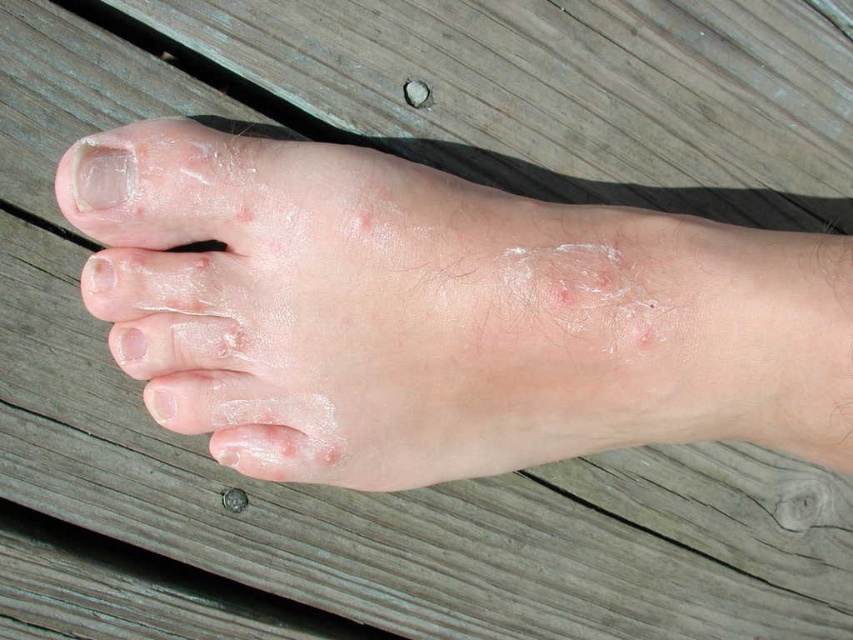
Between dry skin at center and white matte nail at upper left, which one has more height?

With more height is dry skin at center.

Does point (575, 244) come behind point (126, 193)?

That is True.

Does point (389, 294) lie behind point (109, 138)?

That is False.

The height and width of the screenshot is (640, 853). What are the coordinates of `dry skin at center` in the screenshot? It's located at (450, 316).